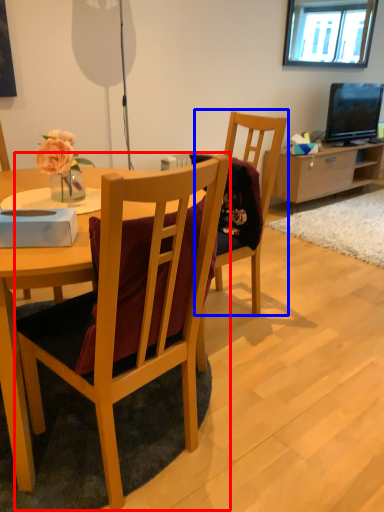
Question: Which object appears closest to the camera in this image, chair (highlighted by a red box) or armchair (highlighted by a blue box)?

Choices:
 (A) chair
 (B) armchair

Answer: (A)